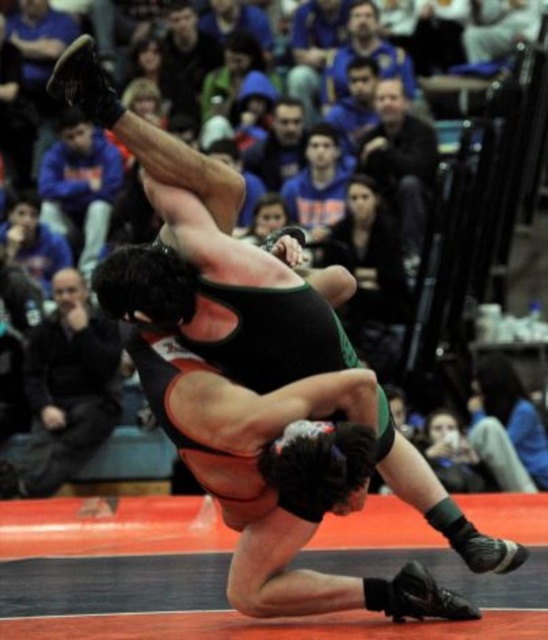
You are a photographer at the wrestling match and want to capture a photo of the blue fleece jacket at upper center without the black fabric referee at left appearing in the foreground. Is this possible given their positions?

The black fabric referee at left is positioned under the blue fleece jacket at upper center, so the referee would block the jacket in the photo. To avoid this, you need to adjust your angle or move higher to frame the jacket without the referee in front.

You are a photographer standing at the center of the wrestling mat. You want to take a photo of the blue fleece jacket at upper center. Which direction should you move to face it?

The blue fleece jacket at upper center is located at point 0.291 on the x axis and 0.146 on the y axis. Since the photographer is at the center, they should move towards the upper left direction to face the blue fleece jacket at upper center.